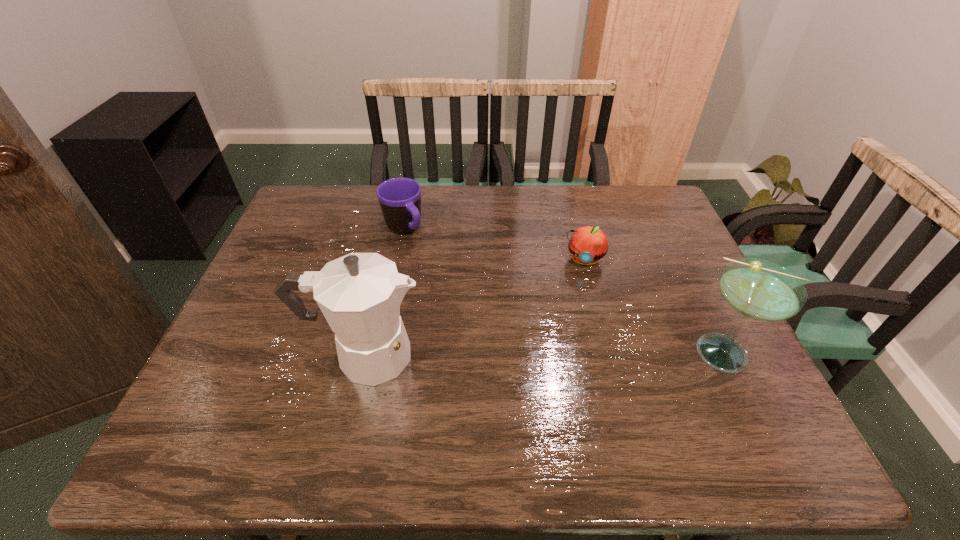
This screenshot has width=960, height=540. Find the location of `vacant space positioned 0.220m on the surface of the second farthest object`. vacant space positioned 0.220m on the surface of the second farthest object is located at coordinates (566, 330).

Where is `free location located 0.370m with the handle on the side of the farthest object`? This screenshot has width=960, height=540. free location located 0.370m with the handle on the side of the farthest object is located at coordinates (481, 323).

Where is `free space located 0.090m with the handle on the side of the farthest object`? Image resolution: width=960 pixels, height=540 pixels. free space located 0.090m with the handle on the side of the farthest object is located at coordinates (427, 260).

The height and width of the screenshot is (540, 960). In order to click on free space located with the handle on the side of the farthest object in this screenshot , I will do `click(440, 274)`.

I want to click on object that is at the far edge, so click(x=400, y=198).

The height and width of the screenshot is (540, 960). In order to click on coffeepot present at the near edge in this screenshot , I will do `click(359, 294)`.

Image resolution: width=960 pixels, height=540 pixels. I want to click on martini that is at the near edge, so (757, 289).

Identify the location of object located at the right edge. The height and width of the screenshot is (540, 960). (757, 289).

Image resolution: width=960 pixels, height=540 pixels. What are the coordinates of `object present at the near right corner` in the screenshot? It's located at tap(757, 289).

This screenshot has height=540, width=960. In the image, there is a desktop. What are the coordinates of `vacant space at the far edge` in the screenshot? It's located at (534, 203).